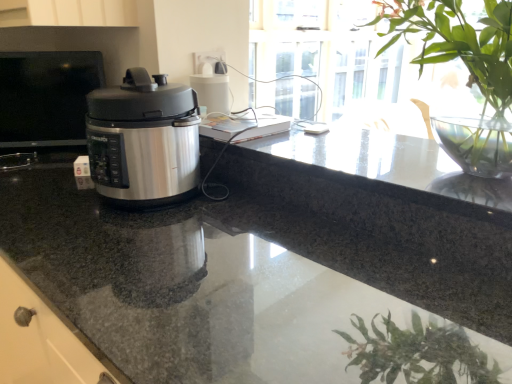
Question: From a real-world perspective, is granite countertop at center positioned above or below metallic silver pressure cooker at left?

Choices:
 (A) above
 (B) below

Answer: (B)

Question: In the image, is granite countertop at center on the left side or the right side of metallic silver pressure cooker at left?

Choices:
 (A) left
 (B) right

Answer: (B)

Question: Which object is positioned closest to the granite countertop at center?

Choices:
 (A) satin silver pressure cooker at left
 (B) metallic silver pressure cooker at left
 (C) green leafy plant at upper right

Answer: (A)

Question: Which object is positioned farthest from the metallic silver pressure cooker at left?

Choices:
 (A) satin silver pressure cooker at left
 (B) granite countertop at center
 (C) green leafy plant at upper right

Answer: (C)